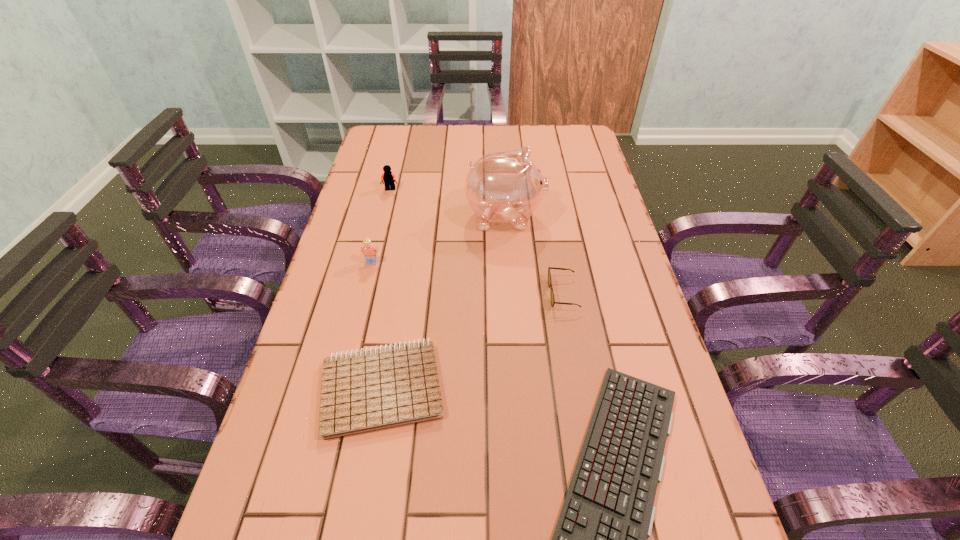
At what (x,y) coordinates should I click in order to perform the action: click on the tallest object. Please return your answer as a coordinate pair (x, y). Looking at the image, I should click on (504, 187).

The height and width of the screenshot is (540, 960). I want to click on the second farthest object, so click(504, 187).

At what (x,y) coordinates should I click in order to perform the action: click on the farthest object. Please return your answer as a coordinate pair (x, y). Image resolution: width=960 pixels, height=540 pixels. Looking at the image, I should click on 388,177.

Where is `the nearer Lego`? the nearer Lego is located at coordinates (370, 252).

The width and height of the screenshot is (960, 540). Identify the location of sunglasses. (553, 302).

Identify the location of the fourth farthest object. (553, 302).

Where is `notebook`? The width and height of the screenshot is (960, 540). notebook is located at coordinates (364, 391).

This screenshot has height=540, width=960. Find the location of `vacant region located 0.110m on the front facing side of the piggy bank`. vacant region located 0.110m on the front facing side of the piggy bank is located at coordinates (582, 216).

Locate an element on the screen. The width and height of the screenshot is (960, 540). free spot located on the front-facing side of the farther Lego is located at coordinates (379, 237).

What are the coordinates of `free space located on the front-facing side of the fourth nearest object` in the screenshot? It's located at (364, 296).